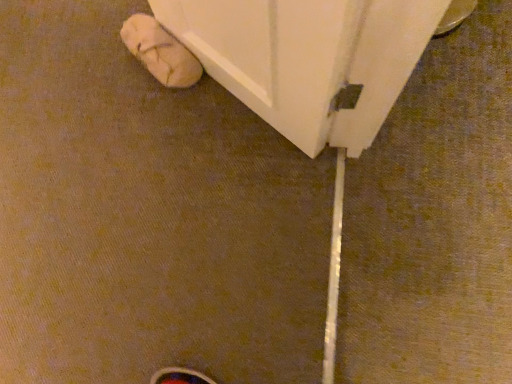
This screenshot has width=512, height=384. What do you see at coordinates (160, 52) in the screenshot?
I see `white fluffy slipper at upper left` at bounding box center [160, 52].

Find the location of a particular element. The height and width of the screenshot is (384, 512). white fluffy slipper at upper left is located at coordinates (160, 52).

Locate an element on the screen. white fluffy slipper at upper left is located at coordinates (160, 52).